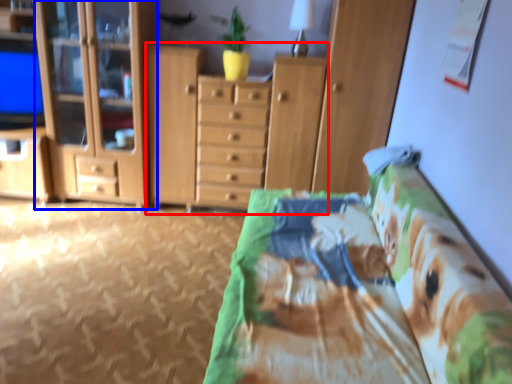
Question: Which of the following is the farthest to the observer, cupboard (highlighted by a red box) or cabinetry (highlighted by a blue box)?

Choices:
 (A) cupboard
 (B) cabinetry

Answer: (A)